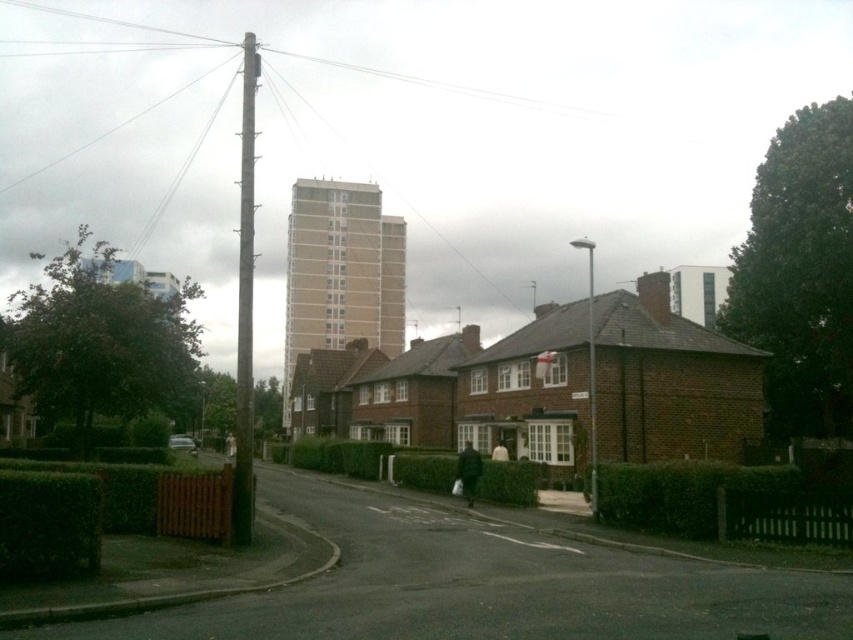
Between point (241, 371) and point (590, 352), which one is positioned behind?

Positioned behind is point (590, 352).

Which is more to the left, smooth metallic pole at center or silver metallic streetlight at center?

From the viewer's perspective, smooth metallic pole at center appears more on the left side.

At what (x,y) coordinates should I click in order to perform the action: click on smooth metallic pole at center. Please return your answer as a coordinate pair (x, y). Looking at the image, I should click on [245, 307].